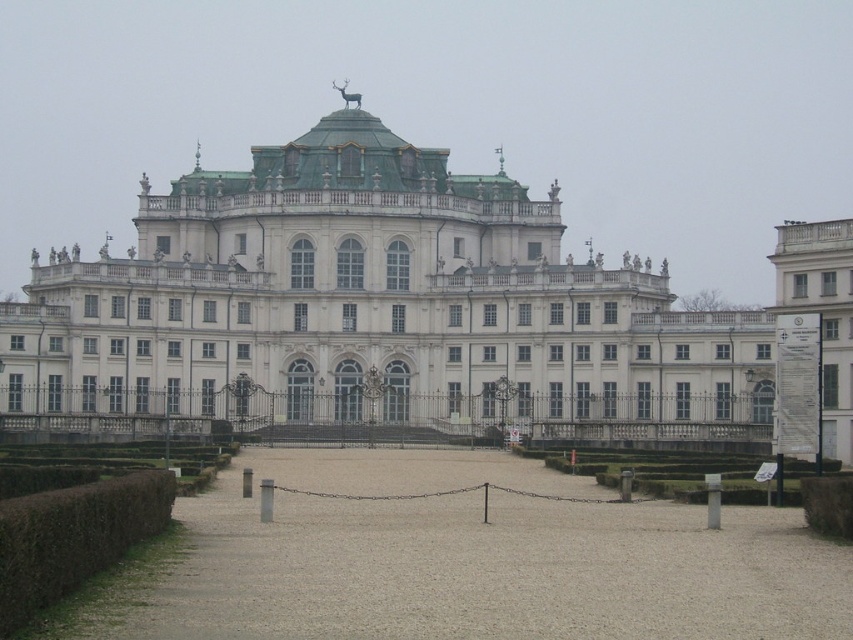
Question: Which of the following is the farthest from the observer?

Choices:
 (A) (128, 474)
 (B) (463, 524)
 (C) (15, 344)

Answer: (C)

Question: Does white stone palace at center have a larger size compared to green leafy hedge at lower left?

Choices:
 (A) yes
 (B) no

Answer: (A)

Question: Can you confirm if white stone palace at center is positioned below green leafy hedge at lower left?

Choices:
 (A) yes
 (B) no

Answer: (B)

Question: Does brown gravel path at center have a lesser width compared to green leafy hedge at lower left?

Choices:
 (A) yes
 (B) no

Answer: (B)

Question: Based on their relative distances, which object is nearer to the brown gravel path at center?

Choices:
 (A) white stone palace at center
 (B) green leafy hedge at lower left

Answer: (B)

Question: Which point is farther to the camera?

Choices:
 (A) brown gravel path at center
 (B) green leafy hedge at lower left

Answer: (A)